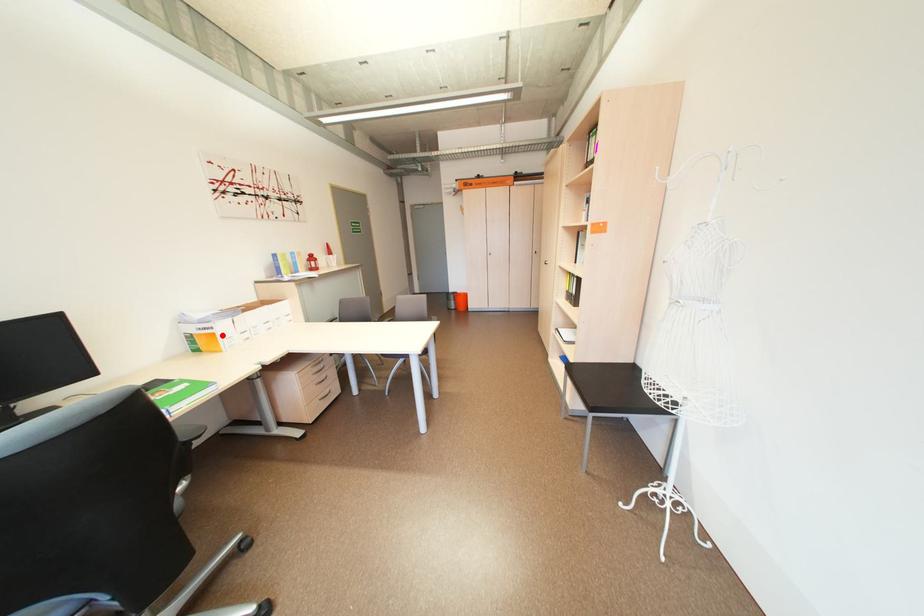
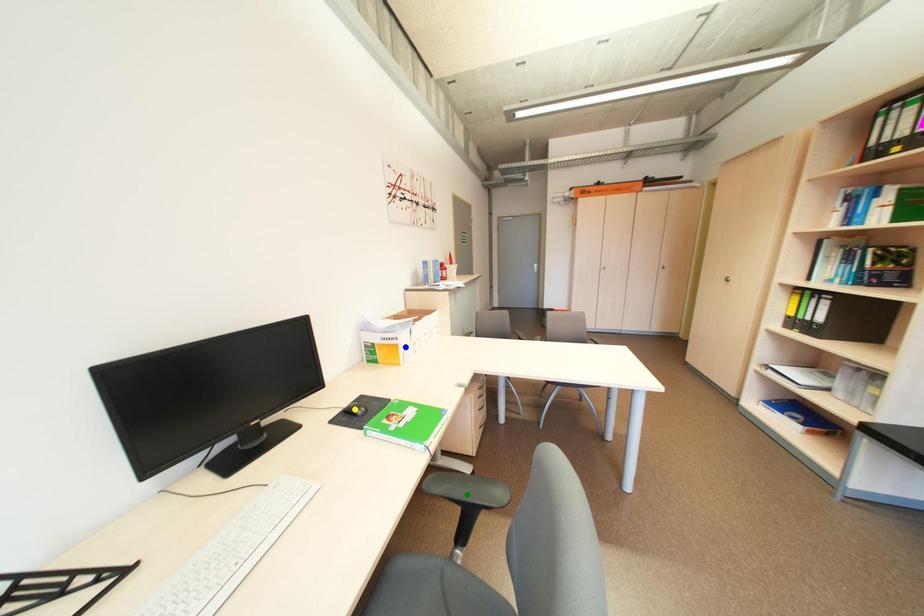
Question: I am providing you with two images of the same scene from different viewpoints. A red point is marked on the first image. You are given multiple points on the second image. Which spot in image 2 lines up with the point in image 1?

Choices:
 (A) blue point
 (B) green point
 (C) yellow point

Answer: (A)